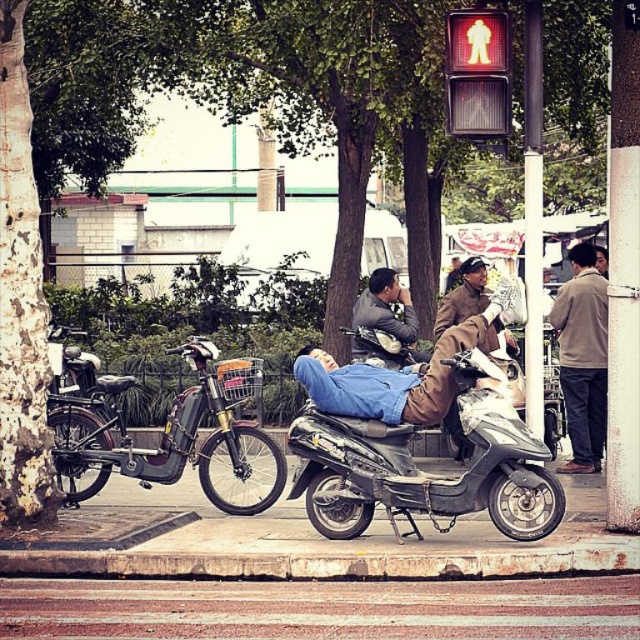
You are a delivery person who needs to place a package on the paved asphalt road at lower center. However, there is a brown leather jacket at center in the way. Can you place the package there without moving the jacket?

The paved asphalt road at lower center is shorter than the brown leather jacket at center, so the jacket is longer and might be covering part of the road. Therefore, you cannot place the package there without moving the jacket.